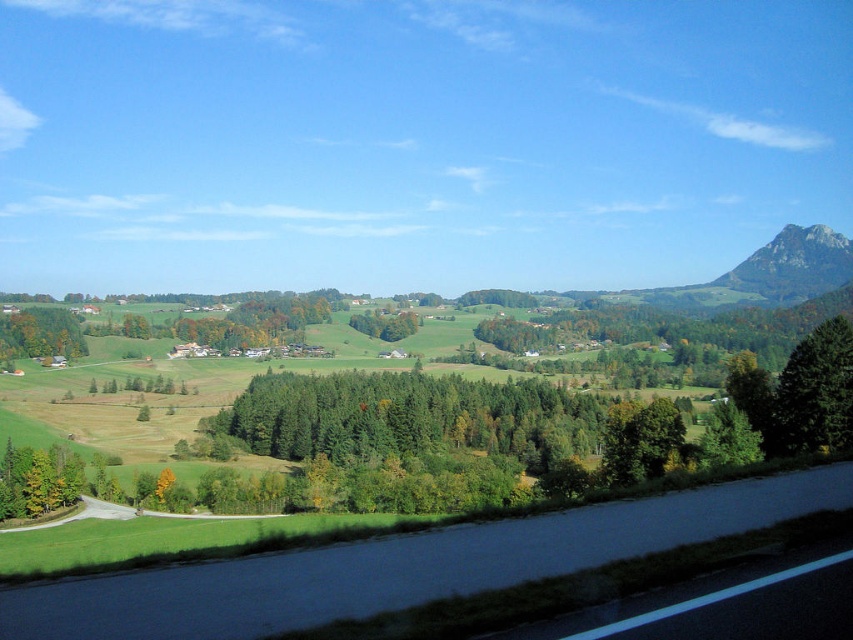
You are driving a car with a 18 feet turning radius. You need to make a turn on the black asphalt road at lower center. Can you make the turn without going off the road?

The black asphalt road at lower center has a turning radius of 21.22 feet, which is larger than your car turning radius of 18 feet. Therefore, you can make the turn without going off the road.